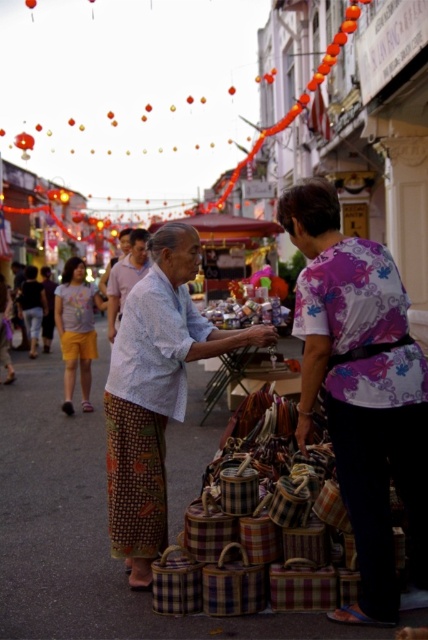
Between plaid fabric baskets at center and light blue woven shirt at center, which one appears on the left side from the viewer's perspective?

Positioned to the left is light blue woven shirt at center.

Is plaid fabric baskets at center bigger than light blue woven shirt at center?

Indeed, plaid fabric baskets at center has a larger size compared to light blue woven shirt at center.

Describe the element at coordinates (362, 392) in the screenshot. Image resolution: width=428 pixels, height=640 pixels. I see `plaid fabric baskets at center` at that location.

Identify the location of plaid fabric baskets at center. (362, 392).

Does point (404, 496) lie in front of point (425, 390)?

No, it is not.

Can you confirm if plaid fabric baskets at center is taller than floral-patterned fabric at center?

No.

Who is more distant from viewer, (407, 397) or (371, 452)?

The point (371, 452) is behind.

The height and width of the screenshot is (640, 428). Find the location of `plaid fabric baskets at center`. plaid fabric baskets at center is located at coordinates (362, 392).

Can you confirm if floral-patterned fabric at center is wider than yellow cotton shorts at left?

Indeed, floral-patterned fabric at center has a greater width compared to yellow cotton shorts at left.

Who is lower down, floral-patterned fabric at center or yellow cotton shorts at left?

Positioned lower is floral-patterned fabric at center.

This screenshot has height=640, width=428. What do you see at coordinates (362, 388) in the screenshot?
I see `floral-patterned fabric at center` at bounding box center [362, 388].

Locate an element on the screen. This screenshot has width=428, height=640. floral-patterned fabric at center is located at coordinates (362, 388).